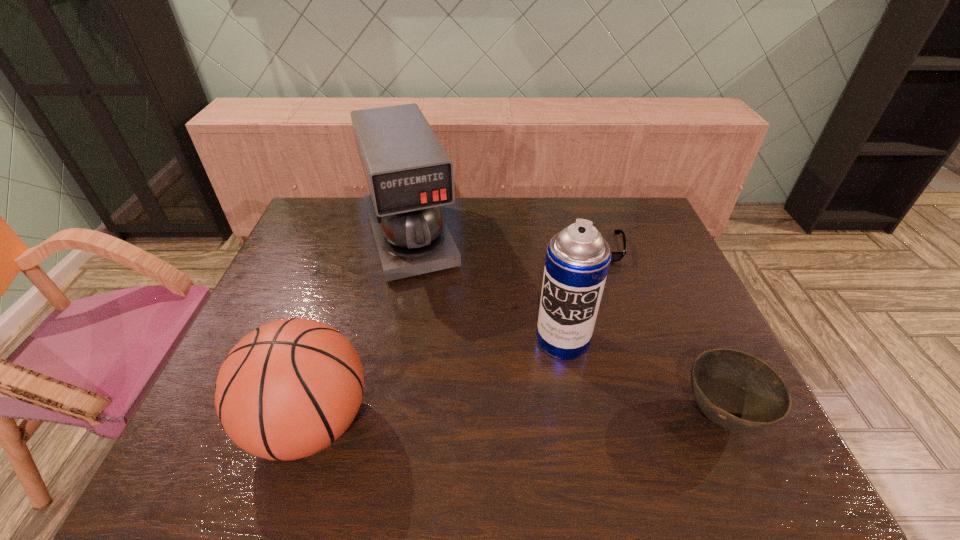
Where is `the third closest object relative to the sunglasses`? This screenshot has height=540, width=960. the third closest object relative to the sunglasses is located at coordinates (738, 391).

Identify the location of free space that satisfies the following two spatial constraints: 1. on the front side of the third object from left to right; 2. on the right side of the coffee maker. The image size is (960, 540). (390, 340).